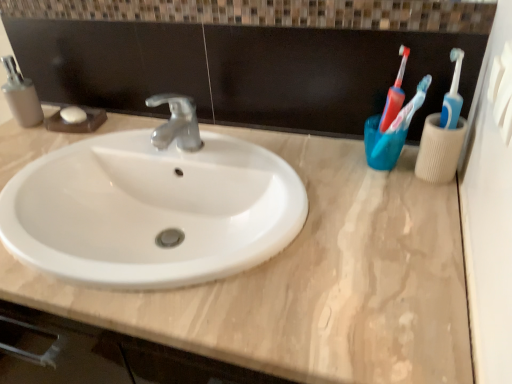
Question: Which is correct: matte gray soap dispenser at left is inside beige marble counter top at center, or outside of it?

Choices:
 (A) outside
 (B) inside

Answer: (A)

Question: In the image, is matte gray soap dispenser at left positioned in front of or behind beige marble counter top at center?

Choices:
 (A) front
 (B) behind

Answer: (B)

Question: Estimate the real-world distances between objects in this image. Which object is closer to the beige marble counter top at center?

Choices:
 (A) matte gray soap dispenser at left
 (B) translucent blue toothbrush at upper right

Answer: (B)

Question: Which is nearer to the matte gray soap dispenser at left?

Choices:
 (A) translucent blue toothbrush at upper right
 (B) beige marble counter top at center

Answer: (B)